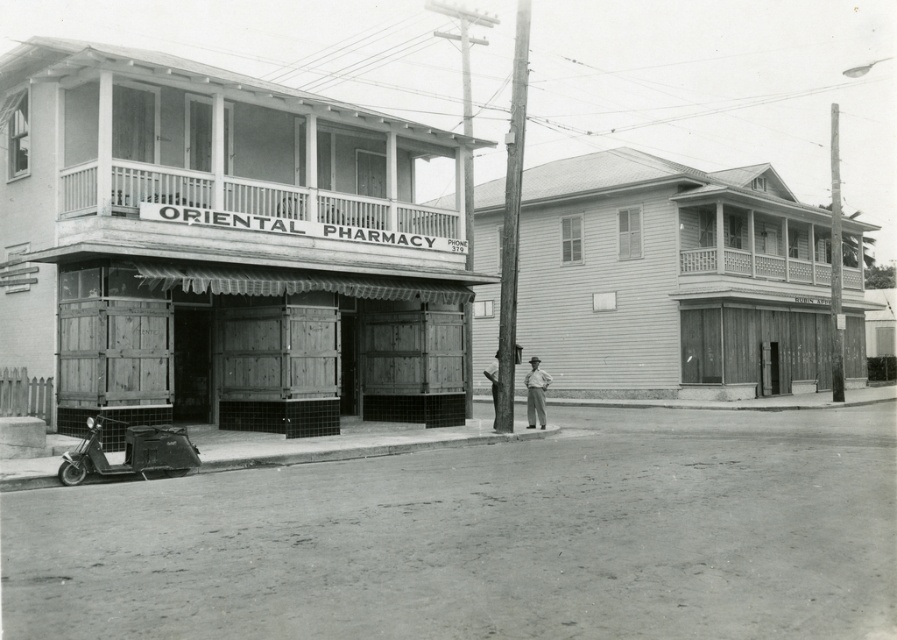
You are standing in front of the pharmacy and want to locate the wooden pole at center. According to the coordinates given, where should you look relative to the pharmacy?

The wooden pole at center is located at coordinates point (512, 218). Since the pharmacy is the focal point in the center of the image, the wooden pole at center is positioned slightly to the left and above the pharmacy.

You are standing at the point marked by the coordinates point (669, 276) in the image. What building are you facing?

The point (669, 276) marks the wooden building at center, so you are facing the wooden building at center.